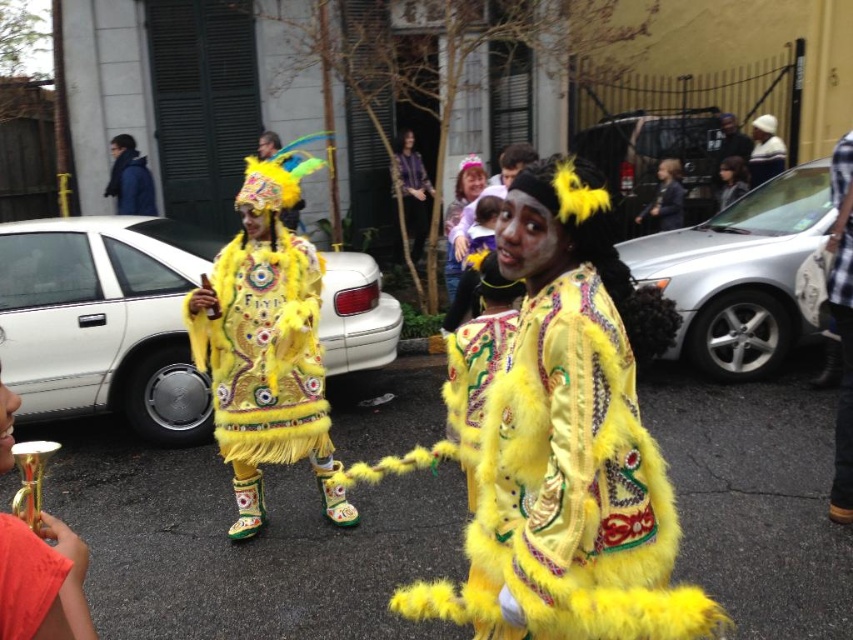
You are a photographer trying to capture a clear shot of both the fuzzy yellow coat at center and the matte yellow costume at center. Since you want both subjects to be fully visible in your photo, which one should you ensure is positioned closer to the front to avoid blocking the other?

The fuzzy yellow coat at center is taller than the matte yellow costume at center. To ensure both are fully visible, position the shorter matte yellow costume at center closer to the front so the taller fuzzy yellow coat at center doesn

You are standing in the middle of the street and want to walk towards the two points marked in the image. Which point, point (x=149, y=211) or point (x=746, y=180), is closer to you?

Point (x=149, y=211) is closer to the viewer than point (x=746, y=180), so you should walk towards point (x=149, y=211) first.

You are a photographer trying to capture both the fuzzy yellow coat at center and the matte yellow costume at center in a single frame. Based on their widths, which one should you adjust your camera angle to prioritize to ensure both are fully visible?

The fuzzy yellow coat at center might be wider than matte yellow costume at center, so you should adjust your camera angle to prioritize the wider fuzzy yellow coat at center to ensure both are fully visible.